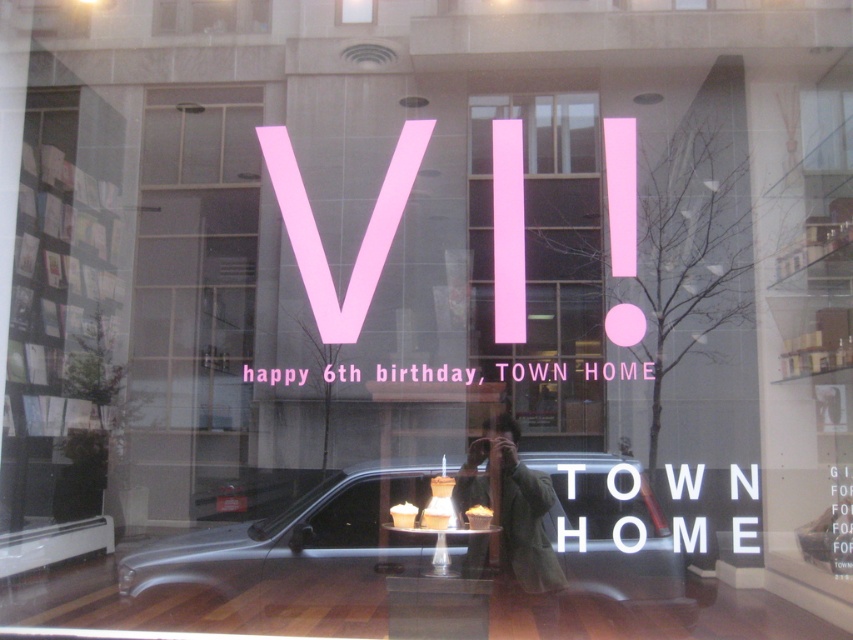
Question: Can you confirm if silver metallic car at center is wider than green fabric jacket at center?

Choices:
 (A) no
 (B) yes

Answer: (B)

Question: Which object appears closest to the camera in this image?

Choices:
 (A) silver metallic car at center
 (B) green fabric jacket at center

Answer: (A)

Question: Which object appears farthest from the camera in this image?

Choices:
 (A) silver metallic car at center
 (B) pink matte sign at center

Answer: (B)

Question: Is silver metallic car at center bigger than green fabric jacket at center?

Choices:
 (A) no
 (B) yes

Answer: (B)

Question: Does silver metallic car at center have a greater width compared to green fabric jacket at center?

Choices:
 (A) no
 (B) yes

Answer: (B)

Question: Which point is closer to the camera?

Choices:
 (A) silver metallic car at center
 (B) pink matte sign at center

Answer: (A)